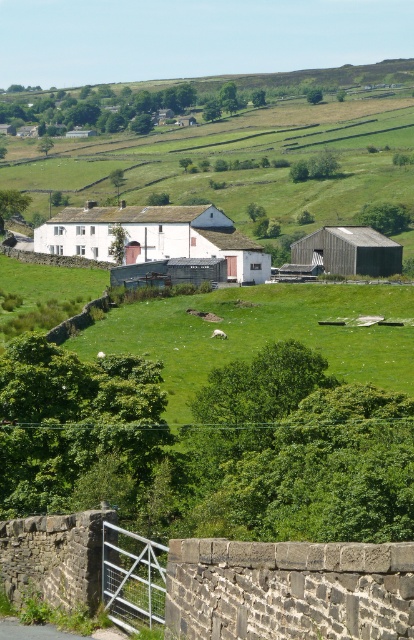
You are a farmer who wants to store hay in the barn. The wooden barn at center has a capacity of 100 bales. How many bales can the white matte barn at center hold if it is larger?

The white matte barn at center is larger in size than wooden barn at center, so it can hold more than 100 bales of hay.

What is located at the point marked by coordinates (154, 236) in the image?

The point marked by coordinates (154, 236) is located at the white matte barn at center.

A drone is flying at a certain altitude and wants to capture a photo of the two points marked as point [166,221]. The drone operator knows that the minimum distance between the drone and the ground must be 150 meters to avoid collision. What is the minimum safe altitude the drone should maintain to ensure both points are in frame and no collision occurs?

The two points marked as point [166,221] are 169.13 meters apart. To ensure both points are in frame and maintain a minimum altitude of 150 meters above the ground, the drone must fly at least 169.13 meters above the ground. However, since the minimum required altitude is 150 meters, the drone should maintain an altitude of at least 169.13 meters to satisfy both conditions.